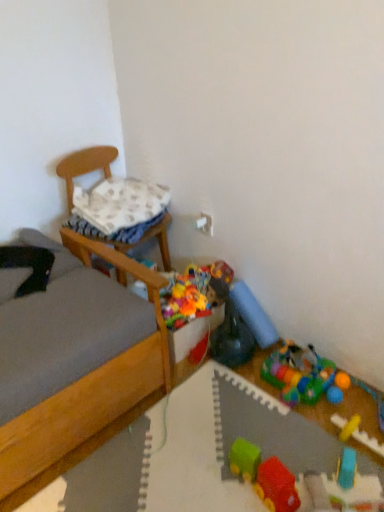
Locate an element on the screen. The width and height of the screenshot is (384, 512). free space to the back side of rubberized plastic train at center, positioned as the 6th toy in back-to-front order is located at coordinates (259, 431).